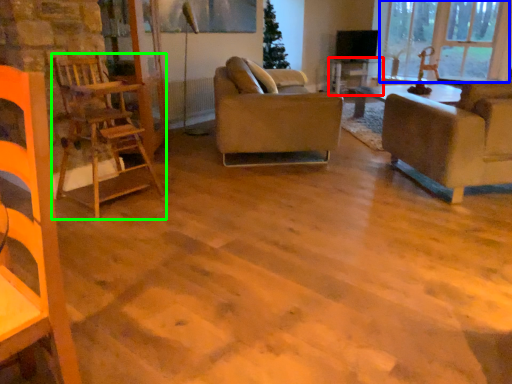
Question: Considering the real-world distances, which object is closest to table (highlighted by a red box)? window (highlighted by a blue box) or chair (highlighted by a green box).

Choices:
 (A) window
 (B) chair

Answer: (A)